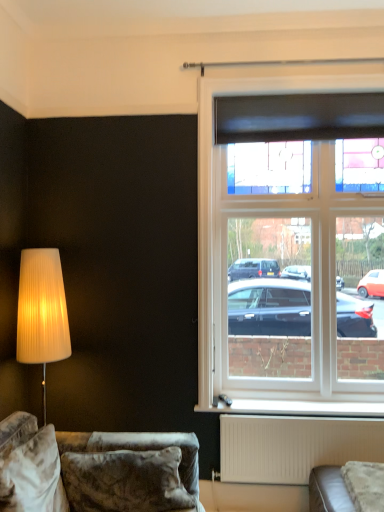
Where is `white plastic window sill at lower center`? The width and height of the screenshot is (384, 512). white plastic window sill at lower center is located at coordinates (295, 408).

Where is `black matte curtain at upper right`? This screenshot has height=512, width=384. black matte curtain at upper right is located at coordinates (298, 117).

The height and width of the screenshot is (512, 384). In order to click on velvet couch at lower left in this screenshot , I will do `click(95, 470)`.

Are stained glass window at upper right and black matte curtain at upper right far apart?

No, there isn't a large distance between stained glass window at upper right and black matte curtain at upper right.

What's the angular difference between stained glass window at upper right and black matte curtain at upper right's facing directions?

They differ by 1.22 degrees in their facing directions.

Considering the relative sizes of stained glass window at upper right and black matte curtain at upper right in the image provided, is stained glass window at upper right bigger than black matte curtain at upper right?

Yes, stained glass window at upper right is bigger than black matte curtain at upper right.

Is stained glass window at upper right aimed at black matte curtain at upper right?

Yes, stained glass window at upper right is oriented towards black matte curtain at upper right.

Measure the distance between white plastic window sill at lower center and stained glass window at upper right.

white plastic window sill at lower center is 52.20 centimeters from stained glass window at upper right.

From the picture: From a real-world perspective, who is located lower, white plastic window sill at lower center or stained glass window at upper right?

white plastic window sill at lower center.

Is white plastic window sill at lower center further to camera compared to stained glass window at upper right?

Yes, white plastic window sill at lower center is further from the camera.

From the image's perspective, is white plastic window sill at lower center located beneath stained glass window at upper right?

Yes.

Is white matte radiator at lower center far from stained glass window at upper right?

They are positioned close to each other.

How far apart are white matte radiator at lower center and stained glass window at upper right?

They are 18.31 inches apart.

Is white matte radiator at lower center in front of stained glass window at upper right?

Yes, white matte radiator at lower center is in front of stained glass window at upper right.

From the picture: Which of these two, white matte radiator at lower center or stained glass window at upper right, is thinner?

stained glass window at upper right is thinner.

Is velvet couch at lower left oriented towards black matte curtain at upper right?

No, velvet couch at lower left is not oriented towards black matte curtain at upper right.

Looking at their sizes, would you say velvet couch at lower left is wider or thinner than black matte curtain at upper right?

Considering their sizes, velvet couch at lower left looks broader than black matte curtain at upper right.

Locate an element on the screen. The width and height of the screenshot is (384, 512). curtain that appears above the velvet couch at lower left (from the image's perspective) is located at coordinates (298, 117).

How much distance is there between black matte curtain at upper right and white plastic window sill at lower center?

black matte curtain at upper right is 1.76 meters away from white plastic window sill at lower center.

How many degrees apart are the facing directions of black matte curtain at upper right and white plastic window sill at lower center?

There is a 0.522-degree angle between the facing directions of black matte curtain at upper right and white plastic window sill at lower center.

Does black matte curtain at upper right turn towards white plastic window sill at lower center?

No.

Consider the image. Considering the sizes of black matte curtain at upper right and white plastic window sill at lower center in the image, is black matte curtain at upper right taller or shorter than white plastic window sill at lower center?

Clearly, black matte curtain at upper right is taller compared to white plastic window sill at lower center.

What's the angular difference between white plastic window sill at lower center and black matte curtain at upper right's facing directions?

The angle between the facing direction of white plastic window sill at lower center and the facing direction of black matte curtain at upper right is 0.522 degrees.

Is point (362, 407) closer to camera compared to point (236, 105)?

Yes, it is.

Which of these two, white plastic window sill at lower center or black matte curtain at upper right, is wider?

white plastic window sill at lower center is wider.

Is white plastic window sill at lower center far from black matte curtain at upper right?

white plastic window sill at lower center is far away from black matte curtain at upper right.

Does white plastic window sill at lower center have a greater width compared to velvet couch at lower left?

No.

From a real-world perspective, who is located lower, white plastic window sill at lower center or velvet couch at lower left?

velvet couch at lower left is physically lower.

Is white plastic window sill at lower center to the left of velvet couch at lower left from the viewer's perspective?

No, white plastic window sill at lower center is not to the left of velvet couch at lower left.

This screenshot has height=512, width=384. Find the location of `curtain that is behind the stained glass window at upper right`. curtain that is behind the stained glass window at upper right is located at coordinates (298, 117).

You are a GUI agent. You are given a task and a screenshot of the screen. Output one action in this format:
    pyautogui.click(x=<x>, y=<y>)
    Task: Click on the window sill below the stained glass window at upper right (from a real-world perspective)
    
    Given the screenshot: What is the action you would take?
    pyautogui.click(x=295, y=408)

Based on their spatial positions, is stained glass window at upper right or black matte curtain at upper right further from white matte radiator at lower center?

black matte curtain at upper right.

Looking at the image, which one is located further to white matte radiator at lower center, velvet couch at lower left or black matte curtain at upper right?

black matte curtain at upper right is positioned further to the anchor white matte radiator at lower center.

Considering their positions, is white plastic window sill at lower center positioned closer to white matte radiator at lower center than stained glass window at upper right?

The object closer to white matte radiator at lower center is white plastic window sill at lower center.

Looking at the image, which one is located further to stained glass window at upper right, white plastic window sill at lower center or black matte curtain at upper right?

white plastic window sill at lower center is positioned further to the anchor stained glass window at upper right.

From the image, which object appears to be nearer to velvet couch at lower left, black matte curtain at upper right or white plastic window sill at lower center?

white plastic window sill at lower center.

Considering their positions, is white matte radiator at lower center positioned further to black matte curtain at upper right than velvet couch at lower left?

velvet couch at lower left is further to black matte curtain at upper right.

From the image, which object appears to be nearer to velvet couch at lower left, stained glass window at upper right or white matte radiator at lower center?

white matte radiator at lower center is closer to velvet couch at lower left.

Which object lies further to the anchor point black matte curtain at upper right, white plastic window sill at lower center or white matte radiator at lower center?

white matte radiator at lower center.

Locate an element on the screen. Image resolution: width=384 pixels, height=512 pixels. window that lies between black matte curtain at upper right and white matte radiator at lower center from top to bottom is located at coordinates (213, 190).

Where is `studio couch between black matte curtain at upper right and white matte radiator at lower center from top to bottom`? The height and width of the screenshot is (512, 384). studio couch between black matte curtain at upper right and white matte radiator at lower center from top to bottom is located at coordinates (95, 470).

This screenshot has width=384, height=512. I want to click on radiator between velvet couch at lower left and stained glass window at upper right along the z-axis, so click(x=293, y=446).

The image size is (384, 512). What are the coordinates of `window positioned between velvet couch at lower left and white plastic window sill at lower center from near to far` in the screenshot? It's located at (213, 190).